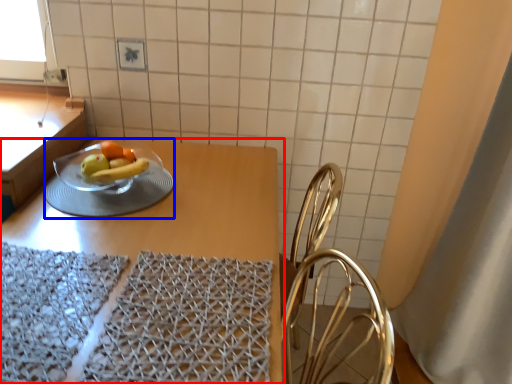
Question: Which object appears farthest to the camera in this image, table (highlighted by a red box) or tableware (highlighted by a blue box)?

Choices:
 (A) table
 (B) tableware

Answer: (B)